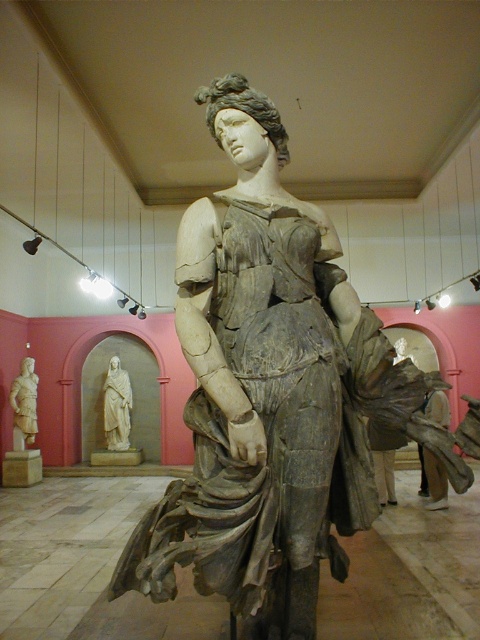
Question: Which of these objects is positioned closest to the light beige marble statue at left?

Choices:
 (A) gray stone statue at center
 (B) white marble statue at center

Answer: (B)

Question: Estimate the real-world distances between objects in this image. Which object is farther from the white marble statue at center?

Choices:
 (A) gray stone statue at center
 (B) light beige marble statue at left

Answer: (A)

Question: Which is nearer to the light beige marble statue at left?

Choices:
 (A) gray stone statue at center
 (B) white marble statue at center

Answer: (B)

Question: From the image, what is the correct spatial relationship of gray stone statue at center in relation to light beige marble statue at left?

Choices:
 (A) above
 (B) below

Answer: (A)

Question: Is gray stone statue at center smaller than white marble statue at center?

Choices:
 (A) yes
 (B) no

Answer: (B)

Question: Does gray stone statue at center appear over light beige marble statue at left?

Choices:
 (A) no
 (B) yes

Answer: (B)